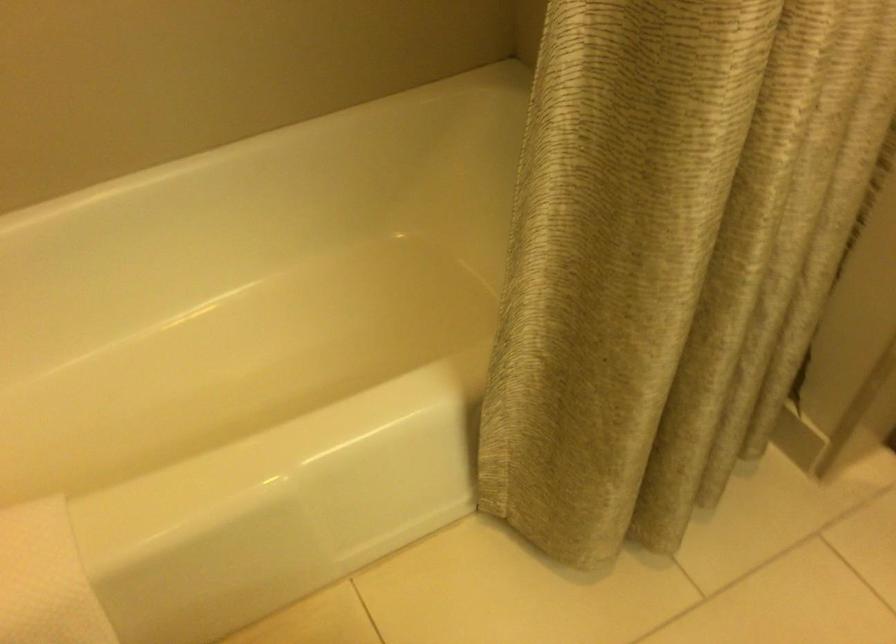
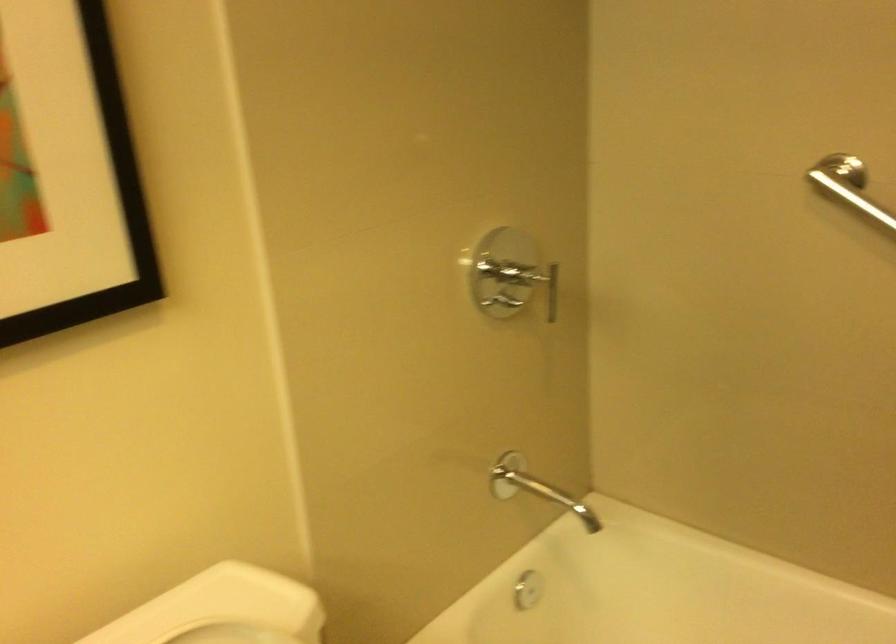
Question: How did the camera likely rotate?

Choices:
 (A) Left
 (B) Right
 (C) Up
 (D) Down

Answer: (A)